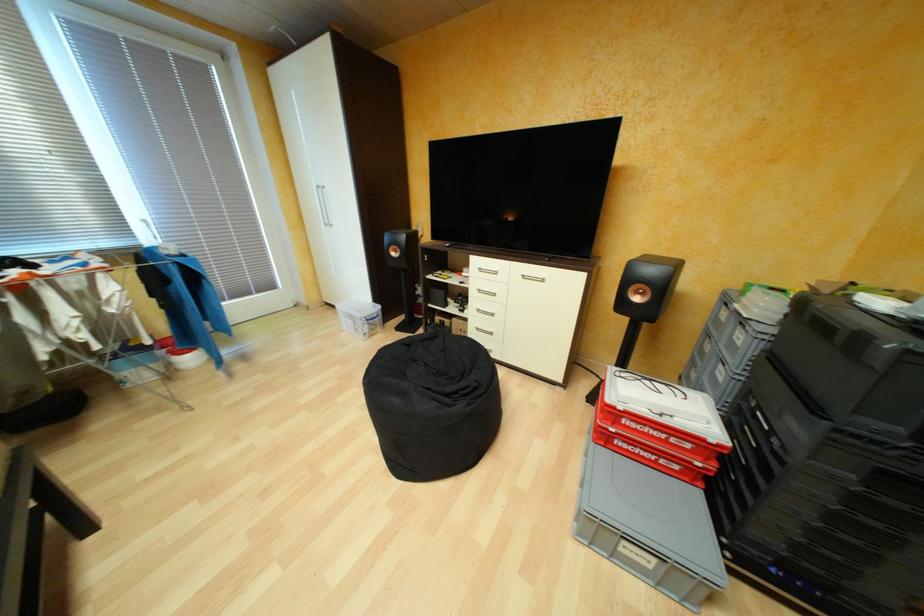
Where would you lift the grey crate handle? Please return your answer as a coordinate pair (x, y).

(784, 432)